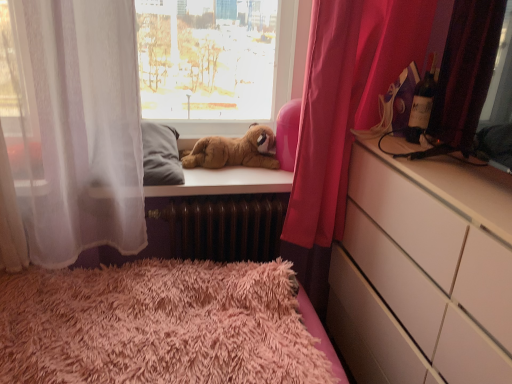
You are a GUI agent. You are given a task and a screenshot of the screen. Output one action in this format:
    pyautogui.click(x=<x>, y=<y>)
    Task: Click on the vacant area situated below velvet dark red curtain at right, acting as the first curtain starting from the front (from a real-world perspective)
    The width and height of the screenshot is (512, 384).
    Given the screenshot: What is the action you would take?
    pyautogui.click(x=467, y=185)